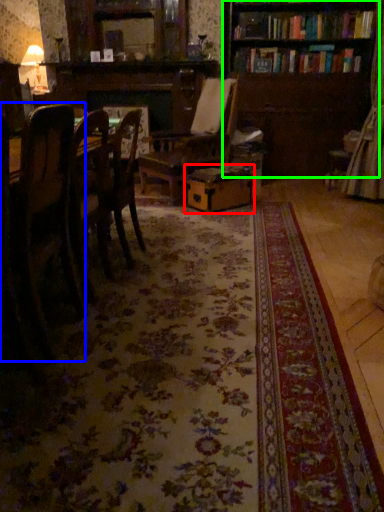
Question: Considering the real-world distances, which object is farthest from cardboard box (highlighted by a red box)? chair (highlighted by a blue box) or bookcase (highlighted by a green box)?

Choices:
 (A) chair
 (B) bookcase

Answer: (A)